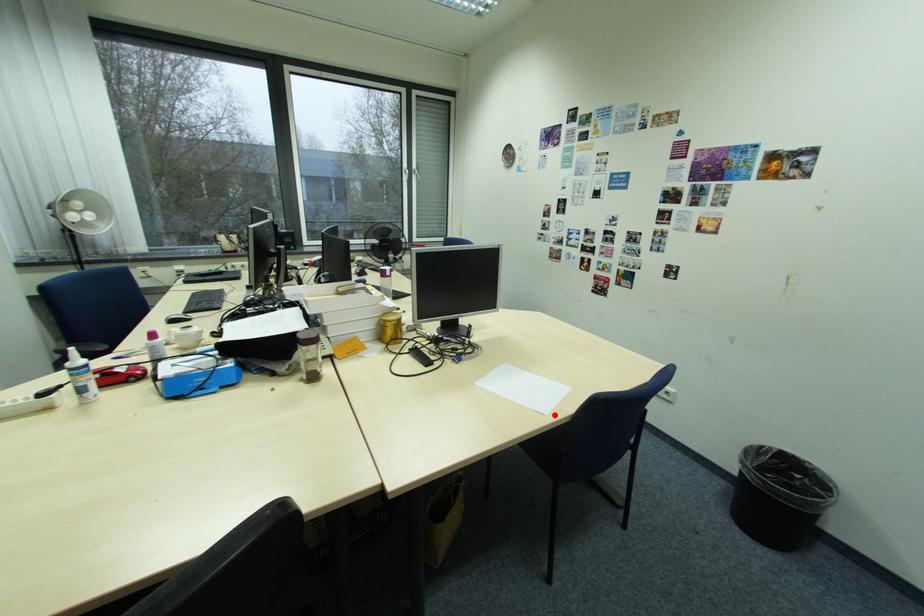
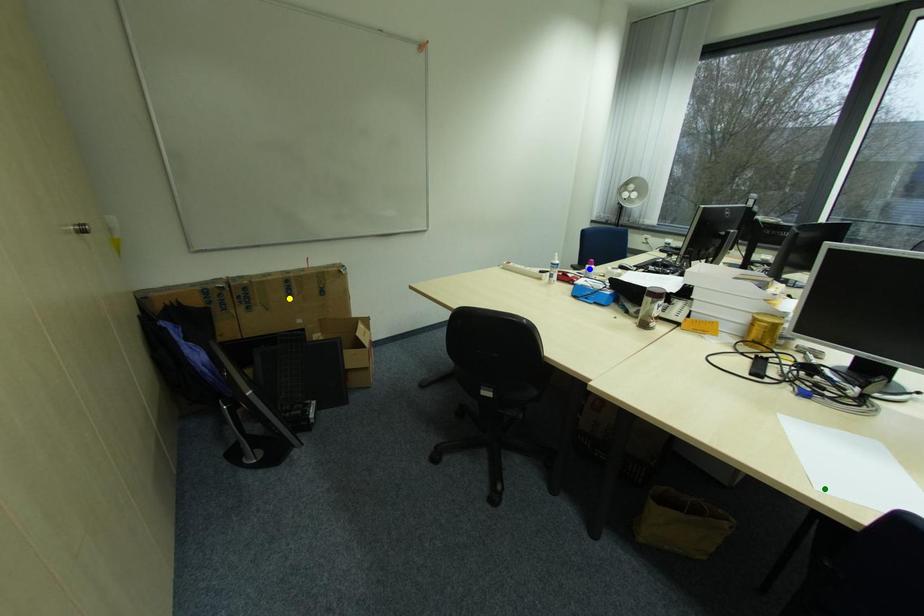
Question: I am providing you with two images of the same scene from different viewpoints. A red point is marked on the first image. You are given multiple points on the second image. Which mark in image 2 goes with the point in image 1?

Choices:
 (A) green point
 (B) yellow point
 (C) blue point

Answer: (A)